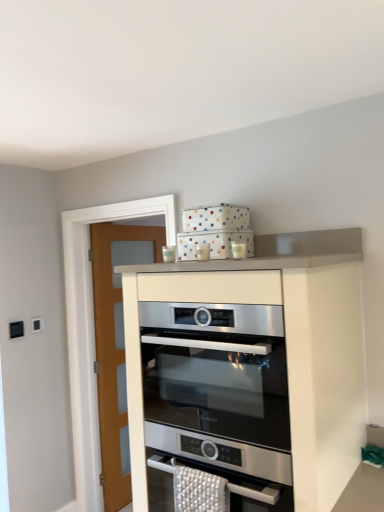
Question: From the image's perspective, is satin white oven at upper center above stainless steel oven at center?

Choices:
 (A) yes
 (B) no

Answer: (B)

Question: Is satin white oven at upper center touching stainless steel oven at center?

Choices:
 (A) yes
 (B) no

Answer: (A)

Question: Are satin white oven at upper center and stainless steel oven at center located far from each other?

Choices:
 (A) no
 (B) yes

Answer: (A)

Question: Is satin white oven at upper center to the right of stainless steel oven at center from the viewer's perspective?

Choices:
 (A) no
 (B) yes

Answer: (B)

Question: Can you confirm if satin white oven at upper center is thinner than stainless steel oven at center?

Choices:
 (A) no
 (B) yes

Answer: (B)

Question: From a real-world perspective, is satin white oven at upper center positioned over stainless steel oven at center based on gravity?

Choices:
 (A) yes
 (B) no

Answer: (B)

Question: Is stainless steel oven at center thinner than satin white oven at upper center?

Choices:
 (A) yes
 (B) no

Answer: (B)

Question: From the image's perspective, is stainless steel oven at center located beneath satin white oven at upper center?

Choices:
 (A) yes
 (B) no

Answer: (B)

Question: Is stainless steel oven at center further to the viewer compared to satin white oven at upper center?

Choices:
 (A) yes
 (B) no

Answer: (A)

Question: Is stainless steel oven at center to the left of satin white oven at upper center from the viewer's perspective?

Choices:
 (A) yes
 (B) no

Answer: (A)

Question: Can you confirm if stainless steel oven at center is taller than satin white oven at upper center?

Choices:
 (A) yes
 (B) no

Answer: (B)

Question: Considering the relative sizes of stainless steel oven at center and satin white oven at upper center in the image provided, is stainless steel oven at center smaller than satin white oven at upper center?

Choices:
 (A) no
 (B) yes

Answer: (B)

Question: From a real-world perspective, is stainless steel oven at center above or below satin white oven at upper center?

Choices:
 (A) below
 (B) above

Answer: (B)